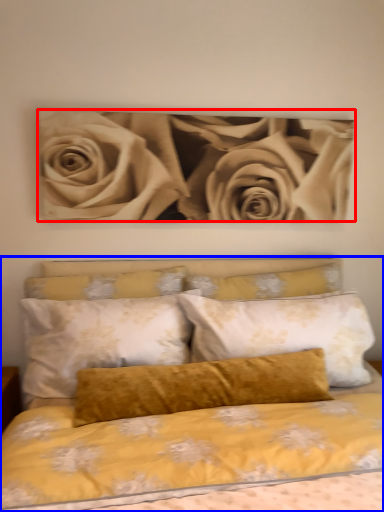
Question: Which object appears farthest to the camera in this image, rose (highlighted by a red box) or bed (highlighted by a blue box)?

Choices:
 (A) rose
 (B) bed

Answer: (A)